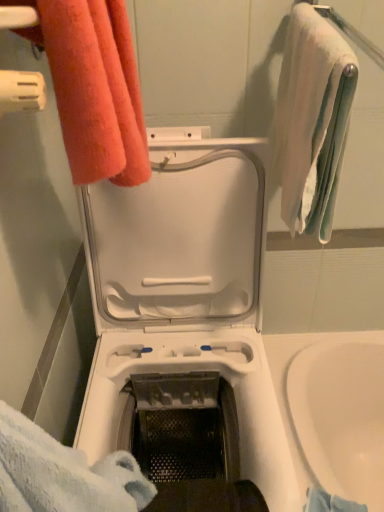
Question: In terms of size, does white soft towel at upper right, arranged as the second towel when viewed from the left, appear bigger or smaller than white plastic washing machine at center?

Choices:
 (A) big
 (B) small

Answer: (B)

Question: Is white soft towel at upper right, arranged as the second towel when viewed from the left, taller or shorter than white plastic washing machine at center?

Choices:
 (A) short
 (B) tall

Answer: (A)

Question: Based on their relative distances, which object is farther from the orange terry cloth towel at upper left, positioned as the 1th towel in left-to-right order?

Choices:
 (A) white plastic washing machine at center
 (B) white soft towel at upper right, arranged as the second towel when viewed from the left

Answer: (A)

Question: Considering the real-world distances, which object is farthest from the white plastic washing machine at center?

Choices:
 (A) white soft towel at upper right, which is counted as the 1th towel, starting from the right
 (B) orange terry cloth towel at upper left, the second towel in the right-to-left sequence

Answer: (B)